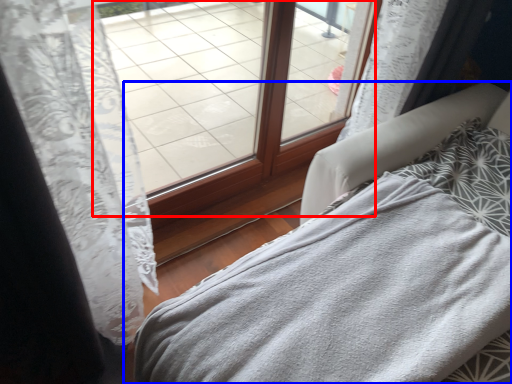
Question: Which of the following is the farthest to the observer, window (highlighted by a red box) or furniture (highlighted by a blue box)?

Choices:
 (A) window
 (B) furniture

Answer: (A)